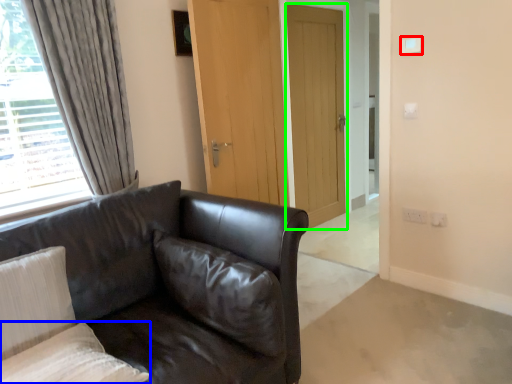
Question: Considering the real-world distances, which object is closest to light switch (highlighted by a red box)? pillow (highlighted by a blue box) or door (highlighted by a green box).

Choices:
 (A) pillow
 (B) door

Answer: (B)